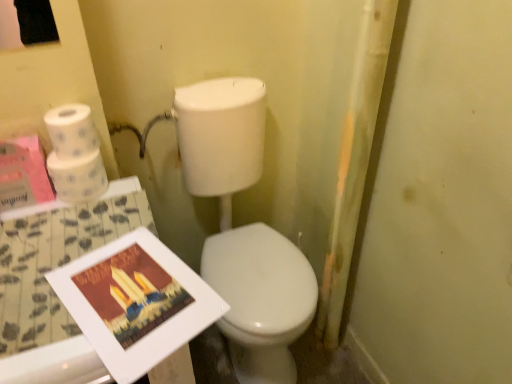
Question: Is point (156, 288) closer or farther from the camera than point (62, 127)?

Choices:
 (A) farther
 (B) closer

Answer: (B)

Question: Visually, is matte paper magazine at lower left positioned to the left or to the right of white matte toilet paper at upper left, which is counted as the second toilet paper, starting from the bottom?

Choices:
 (A) left
 (B) right

Answer: (B)

Question: Estimate the real-world distances between objects in this image. Which object is farther from the white matte toilet paper at upper left, marked as the first toilet paper in a top-to-bottom arrangement?

Choices:
 (A) white glossy toilet at center
 (B) matte paper magazine at lower left
 (C) white glossy table at lower left
 (D) white matte toilet paper at upper left, arranged as the 2th toilet paper when viewed from the top

Answer: (A)

Question: Which object is the closest to the white matte toilet paper at upper left, arranged as the 2th toilet paper when viewed from the top?

Choices:
 (A) white glossy toilet at center
 (B) white matte toilet paper at upper left, which is counted as the second toilet paper, starting from the bottom
 (C) white glossy table at lower left
 (D) matte paper magazine at lower left

Answer: (B)